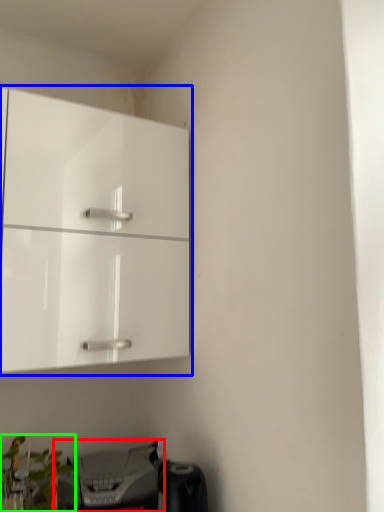
Question: Estimate the real-world distances between objects in this image. Which object is closer to printer (highlighted by a red box), cabinetry (highlighted by a blue box) or plant (highlighted by a green box)?

Choices:
 (A) cabinetry
 (B) plant

Answer: (B)